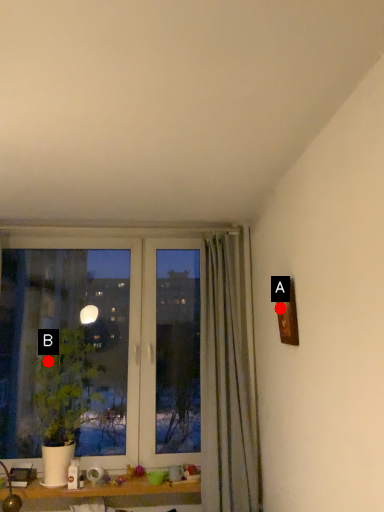
Question: Two points are circled on the image, labeled by A and B beside each circle. Which point is closer to the camera taking this photo?

Choices:
 (A) A is closer
 (B) B is closer

Answer: (A)